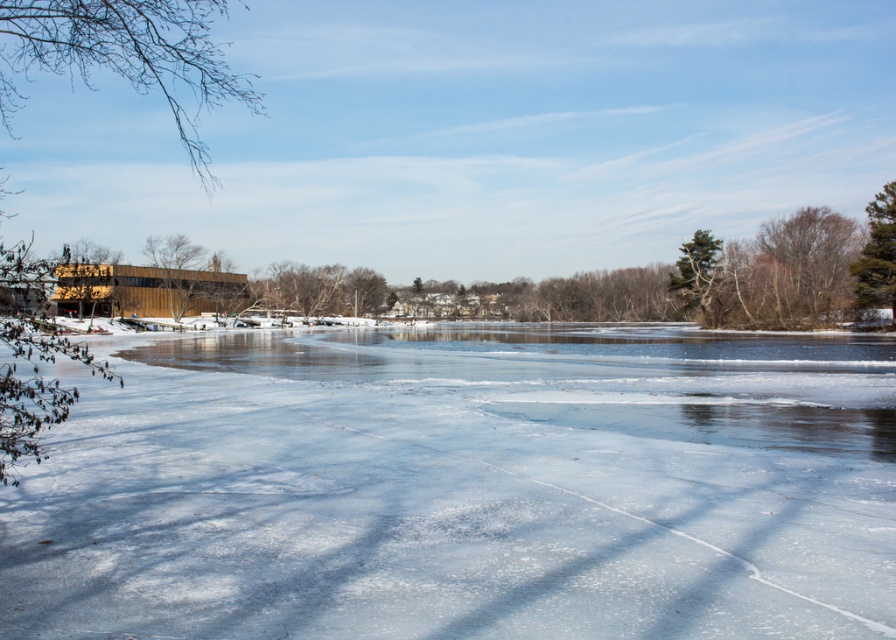
You are standing in the winter scene and want to walk from the brown wood tree at left to the bare branches at upper right. Which direction should you move first?

You should move to the right first because the brown wood tree at left is to the left of the bare branches at upper right.

You are an architect designing a new structure that needs to be placed between the brown wood tree at left and the green textured tree at upper right. Given their sizes, which tree should you consider as the primary reference point for scale when planning the building dimensions?

The brown wood tree at left is larger in size than the green textured tree at upper right, so it should be considered the primary reference point for scale when planning the building dimensions.